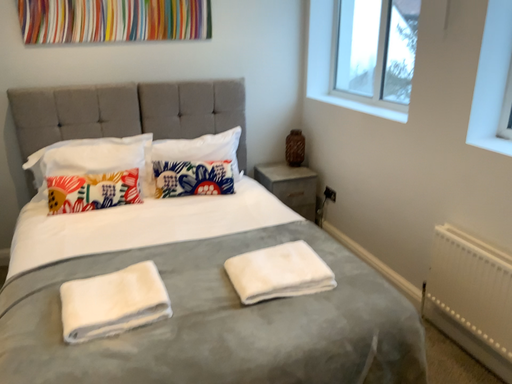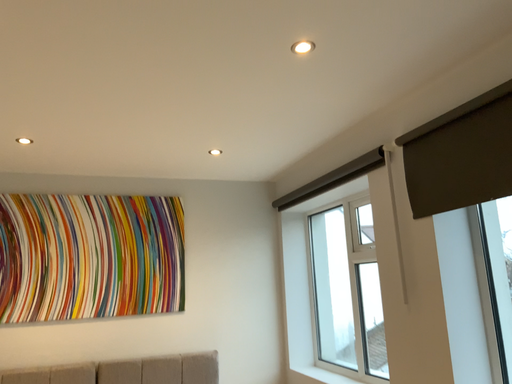
Question: How did the camera likely rotate when shooting the video?

Choices:
 (A) rotated downward
 (B) rotated upward

Answer: (B)